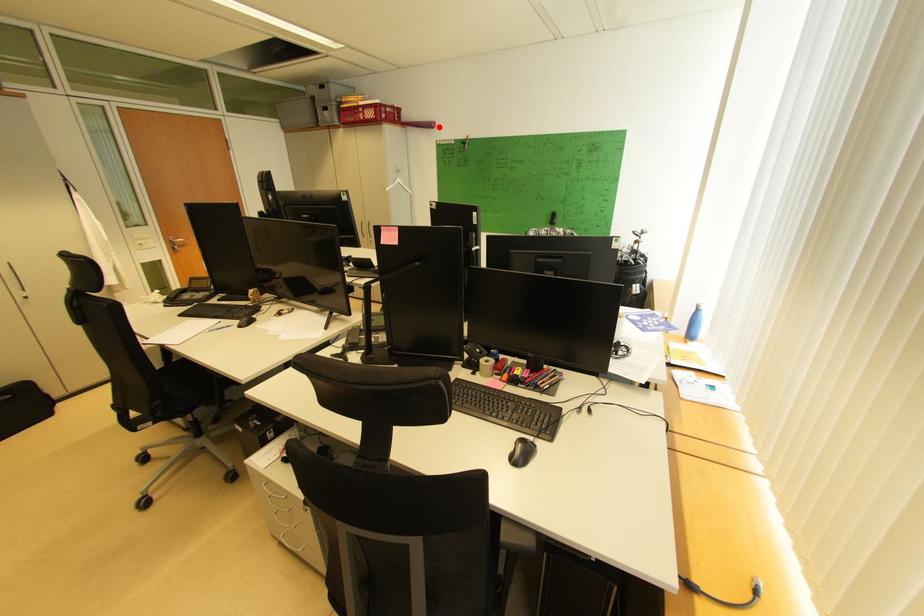
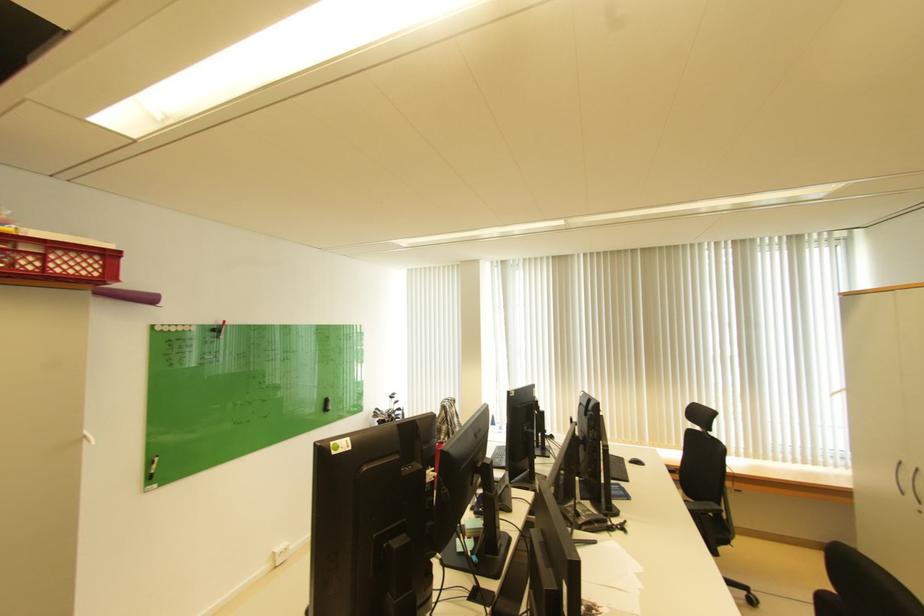
Question: I am providing you with two images of the same scene from different viewpoints. In image1, a red point is highlighted. Considering the same 3D point in image2, which of the following is correct?

Choices:
 (A) It is closer
 (B) It is farther

Answer: (B)